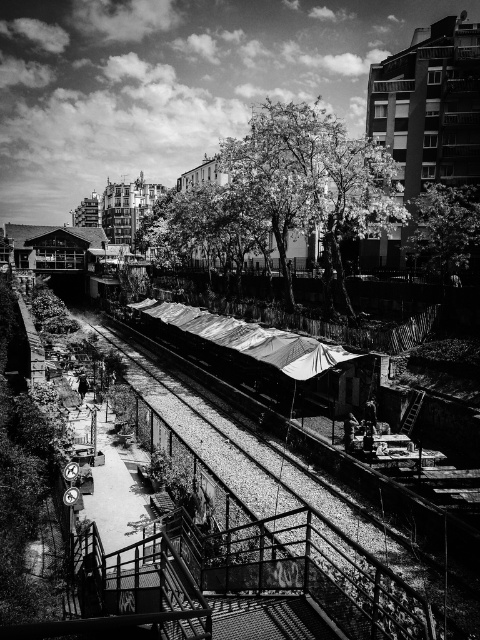
Question: Is smooth bark tree at center thinner than metallic corrugated roof at center?

Choices:
 (A) yes
 (B) no

Answer: (B)

Question: Can you confirm if smooth bark tree at center is smaller than metallic corrugated roof at center?

Choices:
 (A) no
 (B) yes

Answer: (A)

Question: Which of the following is the farthest from the observer?

Choices:
 (A) smooth green tree at upper right
 (B) smooth bark tree at center
 (C) metallic corrugated roof at center

Answer: (B)

Question: Which object is farther from the camera taking this photo?

Choices:
 (A) smooth bark tree at center
 (B) smooth green tree at upper right

Answer: (A)

Question: Does metallic corrugated roof at center come behind smooth green tree at upper right?

Choices:
 (A) yes
 (B) no

Answer: (B)

Question: Which point is closer to the camera?

Choices:
 (A) (271, 330)
 (B) (443, 184)

Answer: (A)